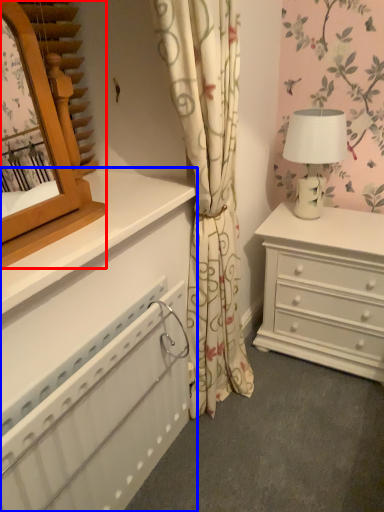
Question: Which point is closer to the camera, mirror (highlighted by a red box) or chest of drawers (highlighted by a blue box)?

Choices:
 (A) mirror
 (B) chest of drawers

Answer: (A)